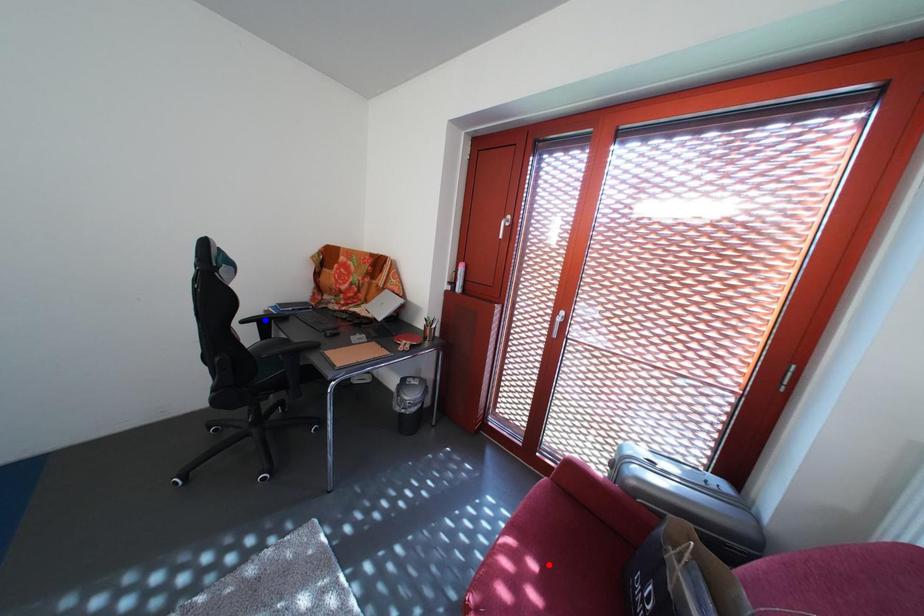
Question: Two points are marked on the image. Which point is closer to the camera?

Choices:
 (A) Blue point is closer.
 (B) Red point is closer.

Answer: (B)